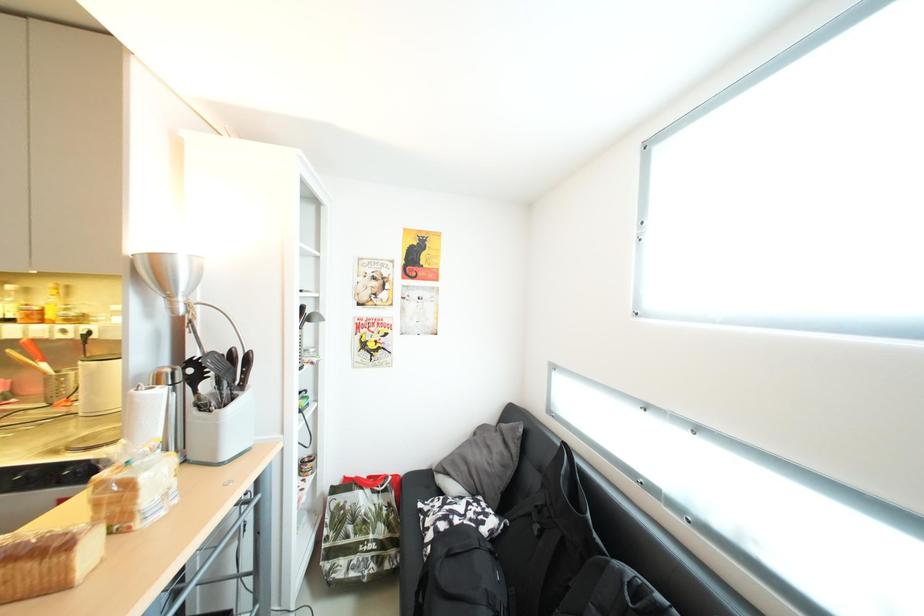
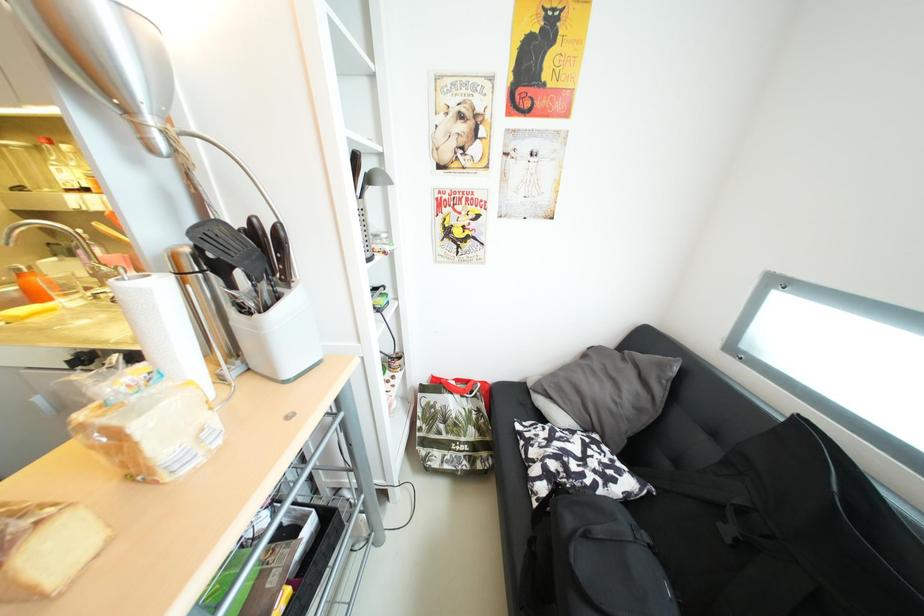
Consider the image. What movement of the cameraman would produce the second image?

The cameraman walked toward left, forward.